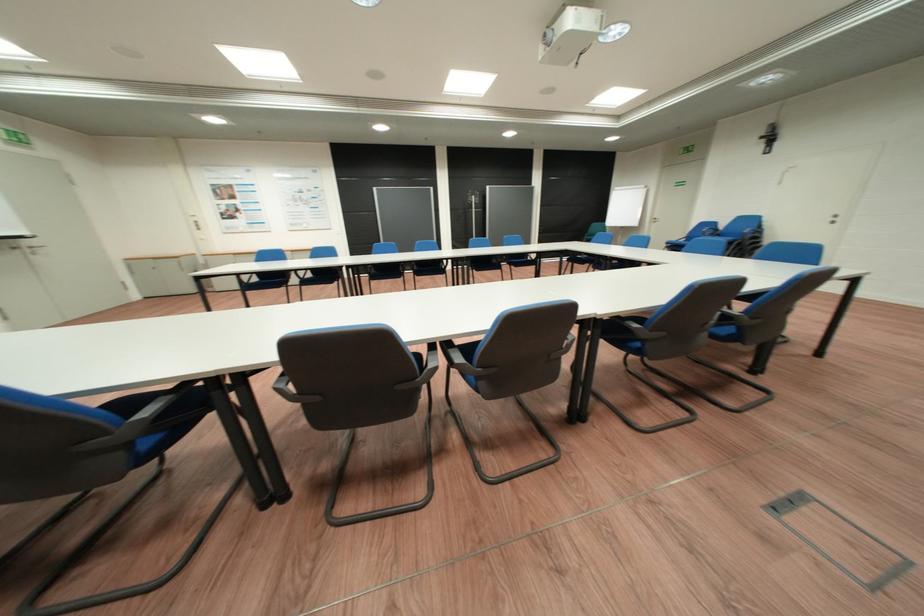
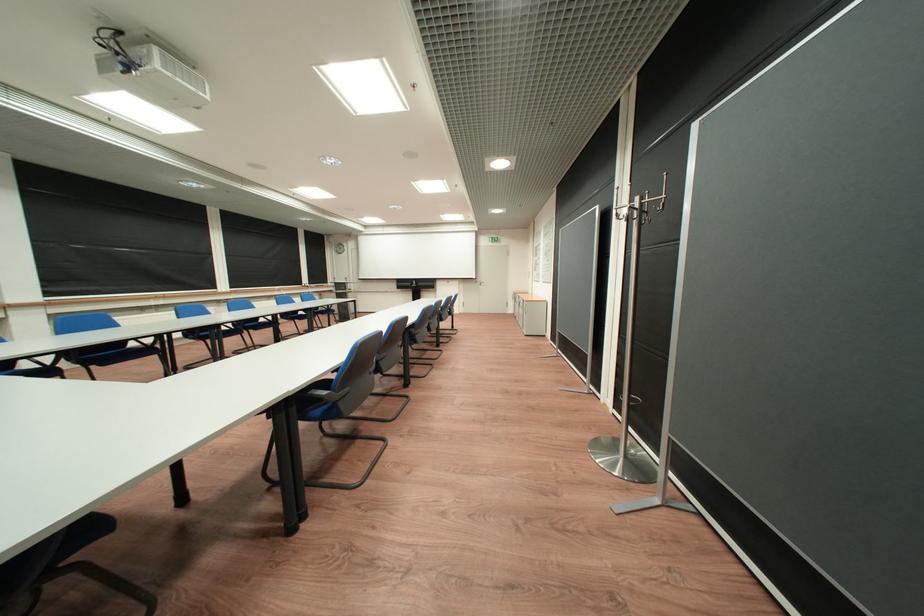
Locate, in the second image, the point that corresponds to the point at 39,235 in the first image.

(487, 278)